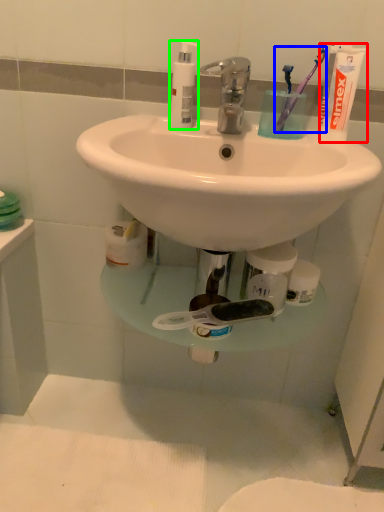
Question: Which object is the farthest from toothpaste (highlighted by a red box)? Choose among these: toothbrush (highlighted by a blue box) or soap dispenser (highlighted by a green box).

Choices:
 (A) toothbrush
 (B) soap dispenser

Answer: (B)